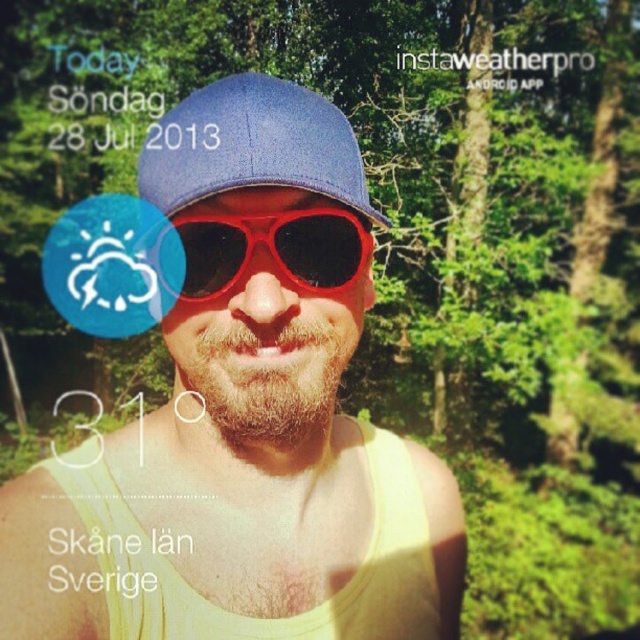
You are a photographer trying to capture the person in the forest. You notice the matte yellow tank top at center and the blue textured baseball cap at center. Which object should you focus on first if you want to photograph the one that is positioned to the right?

The blue textured baseball cap at center is positioned to the right of the matte yellow tank top at center, so you should focus on the blue textured baseball cap at center first.

You are a photographer trying to capture a clear shot of the person in the forest. The blue textured baseball cap at center and shiny plastic goggles at center are both in the frame. Which object is taller and might cause more glare from the sunlight?

The blue textured baseball cap at center is much taller than the shiny plastic goggles at center, so it might cause more glare from the sunlight.

You are a photographer trying to capture the person in the forest. You notice the blue textured baseball cap at center and the shiny plastic goggles at center. Which object would block more of the person face when worn?

The blue textured baseball cap at center has a larger width than the shiny plastic goggles at center, so it would block more of the person face when worn.